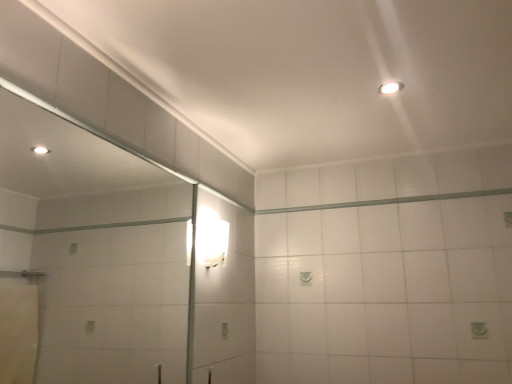
Where is `white glossy light fixture at upper right, marked as the 1th light fixture in a front-to-back arrangement`? The width and height of the screenshot is (512, 384). white glossy light fixture at upper right, marked as the 1th light fixture in a front-to-back arrangement is located at coordinates (391, 87).

Describe the element at coordinates (95, 250) in the screenshot. This screenshot has width=512, height=384. I see `clear glass mirror at left` at that location.

Where is `white glossy wall sconce at upper center, the second light fixture viewed from the right`? white glossy wall sconce at upper center, the second light fixture viewed from the right is located at coordinates (211, 238).

What's the angular difference between white glossy beam at upper center and white glossy light fixture at upper right, which appears as the 2th light fixture when viewed from the back,'s facing directions?

The angular difference between white glossy beam at upper center and white glossy light fixture at upper right, which appears as the 2th light fixture when viewed from the back, is 3.4 degrees.

From a real-world perspective, between white glossy beam at upper center and white glossy light fixture at upper right, marked as the 1th light fixture in a front-to-back arrangement, who is vertically higher?

white glossy light fixture at upper right, marked as the 1th light fixture in a front-to-back arrangement.

Is white glossy beam at upper center completely or partially outside of white glossy light fixture at upper right, marked as the 1th light fixture in a front-to-back arrangement?

Yes, white glossy beam at upper center is located beyond the bounds of white glossy light fixture at upper right, marked as the 1th light fixture in a front-to-back arrangement.

Is white glossy beam at upper center bigger than white glossy light fixture at upper right, which appears as the 2th light fixture when viewed from the back?

Indeed, white glossy beam at upper center has a larger size compared to white glossy light fixture at upper right, which appears as the 2th light fixture when viewed from the back.

What's the angular difference between clear glass mirror at left and white glossy light fixture at upper right, marked as the 1th light fixture in a front-to-back arrangement,'s facing directions?

85.8 degrees separate the facing orientations of clear glass mirror at left and white glossy light fixture at upper right, marked as the 1th light fixture in a front-to-back arrangement.

Does clear glass mirror at left have a greater width compared to white glossy light fixture at upper right, which appears as the second light fixture when viewed from the left?

Incorrect, the width of clear glass mirror at left does not surpass that of white glossy light fixture at upper right, which appears as the second light fixture when viewed from the left.

Is white glossy light fixture at upper right, which appears as the second light fixture when viewed from the left, a part of clear glass mirror at left?

Definitely not — white glossy light fixture at upper right, which appears as the second light fixture when viewed from the left, is not inside clear glass mirror at left.

Could you measure the distance between clear glass mirror at left and white glossy light fixture at upper right, which is the 2th light fixture in bottom-to-top order?

They are 6.56 feet apart.

From the image's perspective, is white glossy light fixture at upper right, marked as the 1th light fixture in a front-to-back arrangement, located above or below clear glass mirror at left?

From the image's perspective, white glossy light fixture at upper right, marked as the 1th light fixture in a front-to-back arrangement, appears above clear glass mirror at left.

Do you think white glossy light fixture at upper right, positioned as the first light fixture in right-to-left order, is within clear glass mirror at left, or outside of it?

white glossy light fixture at upper right, positioned as the first light fixture in right-to-left order, cannot be found inside clear glass mirror at left.

Which is farther from the camera, (394, 84) or (188, 298)?

The point (188, 298) is more distant.

Where is `the 2nd light fixture above when counting from the clear glass mirror at left (from the image's perspective)`? This screenshot has width=512, height=384. the 2nd light fixture above when counting from the clear glass mirror at left (from the image's perspective) is located at coordinates (391, 87).

From the image's perspective, which one is positioned higher, white glossy wall sconce at upper center, which is counted as the second light fixture, starting from the top, or clear glass mirror at left?

white glossy wall sconce at upper center, which is counted as the second light fixture, starting from the top, from the image's perspective.

Where is `the 1st light fixture located above the clear glass mirror at left (from a real-world perspective)`? The image size is (512, 384). the 1st light fixture located above the clear glass mirror at left (from a real-world perspective) is located at coordinates (211, 238).

Which is behind, white glossy wall sconce at upper center, the second light fixture viewed from the right, or clear glass mirror at left?

white glossy wall sconce at upper center, the second light fixture viewed from the right, is further away from the camera.

Looking at this image, is white glossy wall sconce at upper center, the 1th light fixture ordered from the bottom, not near clear glass mirror at left?

Absolutely, white glossy wall sconce at upper center, the 1th light fixture ordered from the bottom, is distant from clear glass mirror at left.

Is clear glass mirror at left not near white glossy beam at upper center?

That's right, there is a large distance between clear glass mirror at left and white glossy beam at upper center.

Considering the relative positions of clear glass mirror at left and white glossy beam at upper center in the image provided, is clear glass mirror at left to the left or to the right of white glossy beam at upper center?

clear glass mirror at left is positioned on white glossy beam at upper center's left side.

Between clear glass mirror at left and white glossy beam at upper center, which one has smaller size?

Smaller between the two is white glossy beam at upper center.

From a real-world perspective, does clear glass mirror at left stand above white glossy beam at upper center?

No, from a real-world perspective, clear glass mirror at left is not over white glossy beam at upper center

Which is behind, white glossy beam at upper center or white glossy wall sconce at upper center, the first light fixture from the back?

white glossy beam at upper center.

Is white glossy beam at upper center facing towards white glossy wall sconce at upper center, the second light fixture viewed from the right?

No, white glossy beam at upper center is not facing towards white glossy wall sconce at upper center, the second light fixture viewed from the right.

Are white glossy beam at upper center and white glossy wall sconce at upper center, the 1th light fixture ordered from the bottom, making contact?

No.

Considering the sizes of white glossy beam at upper center and white glossy wall sconce at upper center, which is counted as the second light fixture, starting from the top, in the image, is white glossy beam at upper center bigger or smaller than white glossy wall sconce at upper center, which is counted as the second light fixture, starting from the top,?

In the image, white glossy beam at upper center appears to be smaller than white glossy wall sconce at upper center, which is counted as the second light fixture, starting from the top.

The image size is (512, 384). Find the location of `beam that is behind the white glossy wall sconce at upper center, which is counted as the 1th light fixture, starting from the left`. beam that is behind the white glossy wall sconce at upper center, which is counted as the 1th light fixture, starting from the left is located at coordinates (388, 201).

Are white glossy wall sconce at upper center, which is counted as the 1th light fixture, starting from the left, and white glossy beam at upper center beside each other?

white glossy wall sconce at upper center, which is counted as the 1th light fixture, starting from the left, and white glossy beam at upper center are not in contact.

In the image, there is a white glossy light fixture at upper right, marked as the 1th light fixture in a front-to-back arrangement. At what (x,y) coordinates should I click in order to perform the action: click on beam below it (from the image's perspective). Please return your answer as a coordinate pair (x, y). Looking at the image, I should click on (388, 201).

Locate an element on the screen. Image resolution: width=512 pixels, height=384 pixels. mirror below the white glossy light fixture at upper right, the 1th light fixture in the top-to-bottom sequence (from a real-world perspective) is located at coordinates (95, 250).

Based on their spatial positions, is clear glass mirror at left or white glossy beam at upper center further from white glossy light fixture at upper right, marked as the 1th light fixture in a front-to-back arrangement?

clear glass mirror at left lies further to white glossy light fixture at upper right, marked as the 1th light fixture in a front-to-back arrangement, than the other object.

Looking at the image, which one is located closer to white glossy wall sconce at upper center, which is counted as the 1th light fixture, starting from the left, clear glass mirror at left or white glossy light fixture at upper right, positioned as the first light fixture in right-to-left order?

white glossy light fixture at upper right, positioned as the first light fixture in right-to-left order, is closer to white glossy wall sconce at upper center, which is counted as the 1th light fixture, starting from the left.

Based on their spatial positions, is white glossy light fixture at upper right, the 1th light fixture in the top-to-bottom sequence, or clear glass mirror at left further from white glossy wall sconce at upper center, which is counted as the second light fixture, starting from the front?

clear glass mirror at left.

Looking at the image, which one is located closer to white glossy wall sconce at upper center, which is counted as the second light fixture, starting from the front, white glossy light fixture at upper right, which appears as the 2th light fixture when viewed from the back, or white glossy beam at upper center?

white glossy beam at upper center is closer to white glossy wall sconce at upper center, which is counted as the second light fixture, starting from the front.

Which object lies further to the anchor point white glossy wall sconce at upper center, the first light fixture from the back, white glossy beam at upper center or white glossy light fixture at upper right, the 1th light fixture in the top-to-bottom sequence?

Among the two, white glossy light fixture at upper right, the 1th light fixture in the top-to-bottom sequence, is located further to white glossy wall sconce at upper center, the first light fixture from the back.

Looking at this image, estimate the real-world distances between objects in this image. Which object is further from white glossy beam at upper center, clear glass mirror at left or white glossy light fixture at upper right, which appears as the second light fixture when viewed from the left?

Among the two, clear glass mirror at left is located further to white glossy beam at upper center.

Which object lies nearer to the anchor point white glossy light fixture at upper right, which appears as the second light fixture when viewed from the left, white glossy beam at upper center or clear glass mirror at left?

white glossy beam at upper center is positioned closer to the anchor white glossy light fixture at upper right, which appears as the second light fixture when viewed from the left.

From the image, which object appears to be nearer to white glossy beam at upper center, white glossy light fixture at upper right, positioned as the first light fixture in right-to-left order, or white glossy wall sconce at upper center, the second light fixture viewed from the right?

white glossy wall sconce at upper center, the second light fixture viewed from the right, is closer to white glossy beam at upper center.

You are a GUI agent. You are given a task and a screenshot of the screen. Output one action in this format:
    pyautogui.click(x=<x>, y=<y>)
    Task: Click on the light fixture located between clear glass mirror at left and white glossy wall sconce at upper center, which is counted as the second light fixture, starting from the front, in the depth direction
    This screenshot has height=384, width=512.
    Given the screenshot: What is the action you would take?
    pyautogui.click(x=391, y=87)

Locate an element on the screen. This screenshot has height=384, width=512. light fixture situated between white glossy wall sconce at upper center, the second light fixture viewed from the right, and white glossy beam at upper center from left to right is located at coordinates (391, 87).